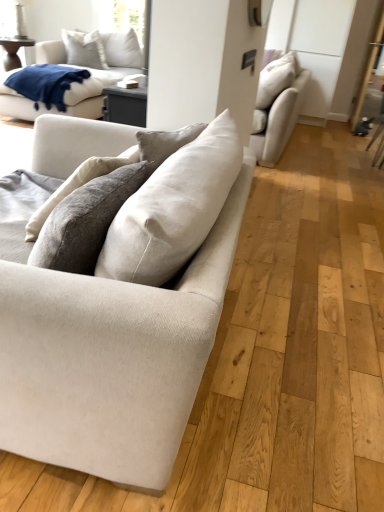
The image size is (384, 512). What do you see at coordinates (46, 84) in the screenshot?
I see `blue soft fabric blanket at upper left` at bounding box center [46, 84].

In order to face white cotton pillow at upper left, should I rotate leftwards or rightwards?

You should look left and rotate roughly 14.267 degrees.

What is the approximate width of white cotton pillow at upper left?

7.97 inches.

I want to click on blue soft fabric blanket at upper left, so [46, 84].

Between beige fabric couch at upper right, arranged as the first studio couch when viewed from the back, and beige fabric couch at center, placed as the second studio couch when sorted from back to front, which one has less height?

beige fabric couch at center, placed as the second studio couch when sorted from back to front.

Is the surface of beige fabric couch at upper right, placed as the first studio couch when sorted from right to left, in direct contact with beige fabric couch at center, the 1th studio couch viewed from the left?

beige fabric couch at upper right, placed as the first studio couch when sorted from right to left, is not next to beige fabric couch at center, the 1th studio couch viewed from the left, and they're not touching.

From the image's perspective, who appears lower, beige fabric couch at upper right, the 2th studio couch when ordered from bottom to top, or beige fabric couch at center, which is counted as the 2th studio couch, starting from the top?

beige fabric couch at center, which is counted as the 2th studio couch, starting from the top, from the image's perspective.

Looking at their sizes, would you say beige fabric couch at center, placed as the second studio couch when sorted from back to front, is wider or thinner than beige fabric couch at upper right, the 2th studio couch viewed from the front?

Clearly, beige fabric couch at center, placed as the second studio couch when sorted from back to front, has more width compared to beige fabric couch at upper right, the 2th studio couch viewed from the front.

From the image's perspective, does beige fabric couch at center, placed as the second studio couch when sorted from back to front, appear higher than beige fabric couch at upper right, arranged as the first studio couch when viewed from the back?

No.

Is beige fabric couch at center, the 1th studio couch viewed from the left, positioned far away from beige fabric couch at upper right, the 2th studio couch viewed from the front?

Yes, beige fabric couch at center, the 1th studio couch viewed from the left, is far from beige fabric couch at upper right, the 2th studio couch viewed from the front.

From the image's perspective, is beige fabric couch at center, placed as the first studio couch when sorted from front to back, under blue soft fabric blanket at upper left?

Yes, from the image's perspective, beige fabric couch at center, placed as the first studio couch when sorted from front to back, is below blue soft fabric blanket at upper left.

Which of these two, beige fabric couch at center, placed as the first studio couch when sorted from front to back, or blue soft fabric blanket at upper left, is smaller?

blue soft fabric blanket at upper left.

In order to click on blanket located underneath the beige fabric couch at center, placed as the first studio couch when sorted from front to back (from a real-world perspective) in this screenshot , I will do `click(46, 84)`.

Is beige fabric couch at center, placed as the second studio couch when sorted from back to front, facing towards blue soft fabric blanket at upper left?

No.

In the scene shown: From a real-world perspective, which object stands above the other?

From a 3D spatial view, white matte cabinet at upper right is above.

Is white matte cabinet at upper right in front of or behind white cotton pillow at upper left in the image?

Visually, white matte cabinet at upper right is located in front of white cotton pillow at upper left.

Is white matte cabinet at upper right to the left of white cotton pillow at upper left from the viewer's perspective?

No, white matte cabinet at upper right is not to the left of white cotton pillow at upper left.

Does white matte cabinet at upper right turn towards white cotton pillow at upper left?

No, white matte cabinet at upper right does not turn towards white cotton pillow at upper left.

Can beige fabric couch at center, placed as the first studio couch when sorted from front to back, be found inside white matte cabinet at upper right?

No, beige fabric couch at center, placed as the first studio couch when sorted from front to back, is not surrounded by white matte cabinet at upper right.

Considering the sizes of white matte cabinet at upper right and beige fabric couch at center, arranged as the first studio couch when ordered from the bottom, in the image, is white matte cabinet at upper right bigger or smaller than beige fabric couch at center, arranged as the first studio couch when ordered from the bottom,?

In the image, white matte cabinet at upper right appears to be smaller than beige fabric couch at center, arranged as the first studio couch when ordered from the bottom.

Is white matte cabinet at upper right far from beige fabric couch at center, the 1th studio couch viewed from the left?

That's right, there is a large distance between white matte cabinet at upper right and beige fabric couch at center, the 1th studio couch viewed from the left.

From a real-world perspective, is white matte cabinet at upper right under beige fabric couch at center, placed as the first studio couch when sorted from front to back?

No, from a real-world perspective, white matte cabinet at upper right is not beneath beige fabric couch at center, placed as the first studio couch when sorted from front to back.

From the picture: From a real-world perspective, relative to beige fabric couch at upper right, placed as the first studio couch when sorted from right to left, is white cotton pillow at upper left vertically above or below?

white cotton pillow at upper left is above beige fabric couch at upper right, placed as the first studio couch when sorted from right to left.

Who is taller, white cotton pillow at upper left or beige fabric couch at upper right, the 2th studio couch viewed from the front?

With more height is beige fabric couch at upper right, the 2th studio couch viewed from the front.

Does white cotton pillow at upper left have a larger size compared to beige fabric couch at upper right, placed as the first studio couch when sorted from right to left?

Actually, white cotton pillow at upper left might be smaller than beige fabric couch at upper right, placed as the first studio couch when sorted from right to left.

Is white cotton pillow at upper left aimed at beige fabric couch at upper right, the first studio couch from the top?

No, white cotton pillow at upper left does not turn towards beige fabric couch at upper right, the first studio couch from the top.

Is beige fabric couch at center, which is counted as the 2th studio couch, starting from the top, beside white cotton pillow at upper left?

No, beige fabric couch at center, which is counted as the 2th studio couch, starting from the top, is not with white cotton pillow at upper left.

Who is shorter, beige fabric couch at center, the 1th studio couch viewed from the left, or white cotton pillow at upper left?

Standing shorter between the two is white cotton pillow at upper left.

Would you say beige fabric couch at center, the 1th studio couch viewed from the left, is to the left or to the right of white cotton pillow at upper left in the picture?

In the image, beige fabric couch at center, the 1th studio couch viewed from the left, appears on the right side of white cotton pillow at upper left.

Where is `studio couch above the beige fabric couch at center, the 2th studio couch when ordered from right to left (from the image's perspective)`? The height and width of the screenshot is (512, 384). studio couch above the beige fabric couch at center, the 2th studio couch when ordered from right to left (from the image's perspective) is located at coordinates (277, 106).

This screenshot has height=512, width=384. Identify the location of studio couch beneath the beige fabric couch at upper right, the first studio couch from the top (from a real-world perspective). (111, 359).

Considering their positions, is beige fabric couch at upper right, arranged as the first studio couch when viewed from the back, positioned further to white cotton pillow at upper left than beige fabric couch at center, the 2th studio couch when ordered from right to left?

beige fabric couch at center, the 2th studio couch when ordered from right to left.

From the image, which object appears to be nearer to white matte cabinet at upper right, beige fabric couch at center, the 1th studio couch viewed from the left, or blue soft fabric blanket at upper left?

blue soft fabric blanket at upper left.

Based on their spatial positions, is beige fabric couch at center, placed as the first studio couch when sorted from front to back, or beige fabric couch at upper right, placed as the first studio couch when sorted from right to left, closer to blue soft fabric blanket at upper left?

beige fabric couch at upper right, placed as the first studio couch when sorted from right to left, is closer to blue soft fabric blanket at upper left.

Looking at the image, which one is located closer to beige fabric couch at center, which is counted as the 2th studio couch, starting from the top, blue soft fabric blanket at upper left or white matte cabinet at upper right?

The object closer to beige fabric couch at center, which is counted as the 2th studio couch, starting from the top, is blue soft fabric blanket at upper left.

Which object lies further to the anchor point blue soft fabric blanket at upper left, white cotton pillow at upper left or white matte cabinet at upper right?

white matte cabinet at upper right is positioned further to the anchor blue soft fabric blanket at upper left.

When comparing their distances from white matte cabinet at upper right, does beige fabric couch at upper right, placed as the first studio couch when sorted from right to left, or beige fabric couch at center, which is counted as the 2th studio couch, starting from the top, seem closer?

beige fabric couch at upper right, placed as the first studio couch when sorted from right to left, is closer to white matte cabinet at upper right.

When comparing their distances from white matte cabinet at upper right, does white cotton pillow at upper left or beige fabric couch at upper right, the 2th studio couch when ordered from bottom to top, seem closer?

beige fabric couch at upper right, the 2th studio couch when ordered from bottom to top, is positioned closer to the anchor white matte cabinet at upper right.

From the image, which object appears to be farther from blue soft fabric blanket at upper left, beige fabric couch at upper right, which is the 2th studio couch from left to right, or beige fabric couch at center, the 2th studio couch when ordered from right to left?

beige fabric couch at center, the 2th studio couch when ordered from right to left.

The width and height of the screenshot is (384, 512). In order to click on pillow located between blue soft fabric blanket at upper left and beige fabric couch at upper right, the 2th studio couch viewed from the front, in the left-right direction in this screenshot , I will do `click(84, 49)`.

Where is `studio couch between beige fabric couch at center, placed as the first studio couch when sorted from front to back, and white matte cabinet at upper right, along the z-axis`? The image size is (384, 512). studio couch between beige fabric couch at center, placed as the first studio couch when sorted from front to back, and white matte cabinet at upper right, along the z-axis is located at coordinates (277, 106).

The width and height of the screenshot is (384, 512). I want to click on blanket between beige fabric couch at center, placed as the second studio couch when sorted from back to front, and white matte cabinet at upper right in the front-back direction, so click(x=46, y=84).

This screenshot has height=512, width=384. Identify the location of studio couch located between beige fabric couch at center, the 2th studio couch when ordered from right to left, and blue soft fabric blanket at upper left in the depth direction. (x=277, y=106).